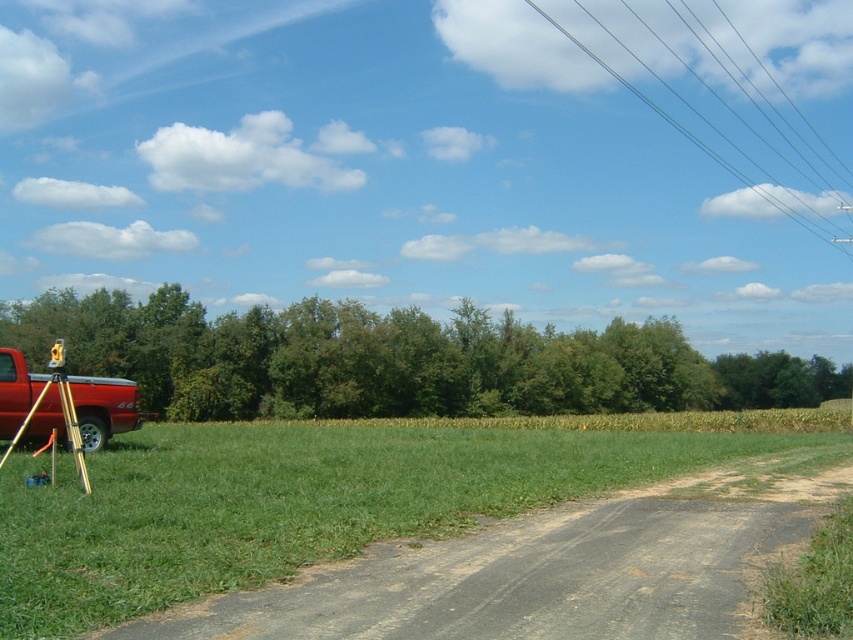
Question: Which point is farther to the camera?

Choices:
 (A) gray asphalt road at lower center
 (B) metallic red pickup truck at left
 (C) black wire at upper right
 (D) gold metallic tripod at lower left

Answer: (C)

Question: Which is nearer to the black wire at upper right?

Choices:
 (A) gray asphalt road at lower center
 (B) metallic red pickup truck at left

Answer: (B)

Question: Can you confirm if metallic red pickup truck at left is thinner than gold metallic tripod at lower left?

Choices:
 (A) no
 (B) yes

Answer: (B)

Question: Which object is positioned closest to the black wire at upper right?

Choices:
 (A) gold metallic tripod at lower left
 (B) gray asphalt road at lower center

Answer: (B)

Question: Does gray asphalt road at lower center have a lesser width compared to black wire at upper right?

Choices:
 (A) yes
 (B) no

Answer: (A)

Question: Is the position of gray asphalt road at lower center more distant than that of gold metallic tripod at lower left?

Choices:
 (A) yes
 (B) no

Answer: (B)